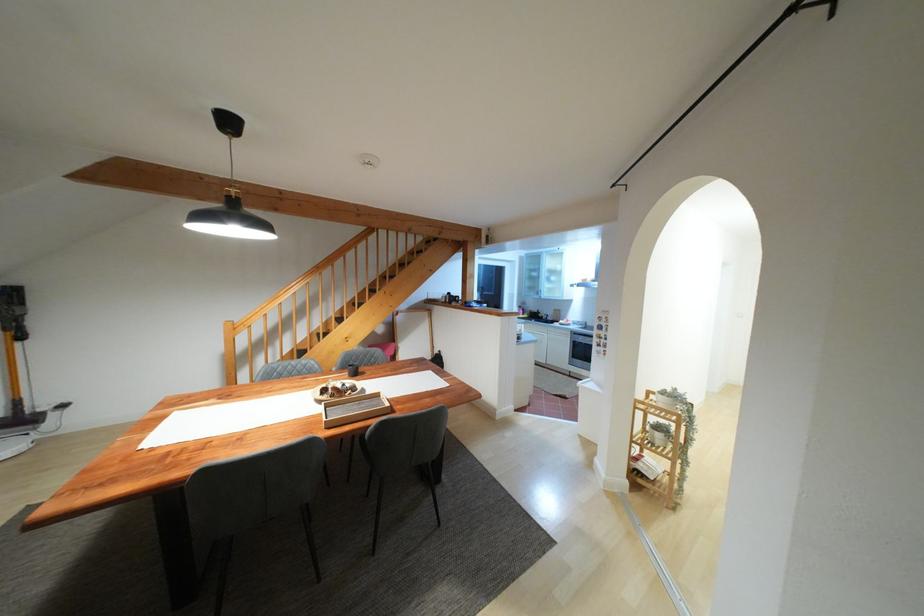
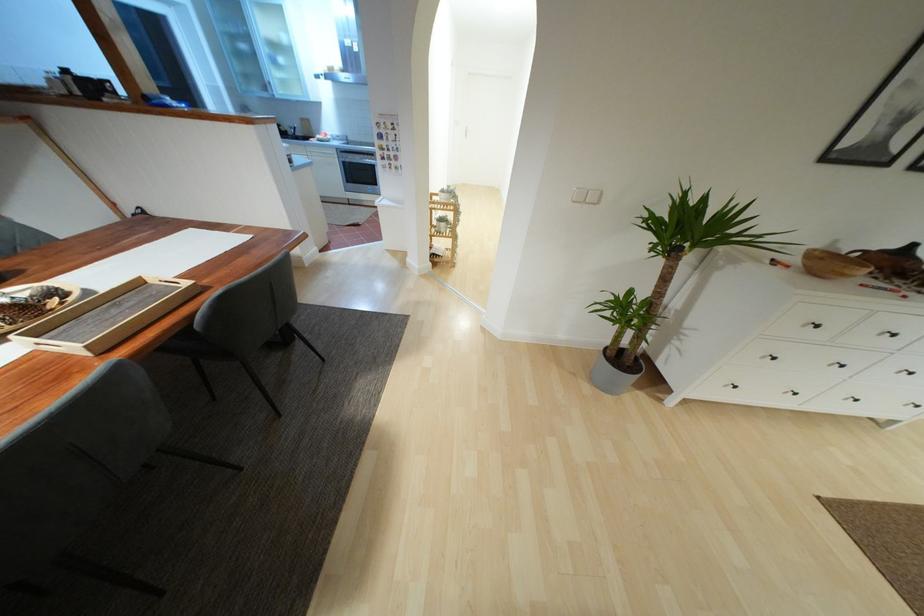
Locate, in the second image, the point that corresponds to the point at 585,385 in the first image.

(382, 203)